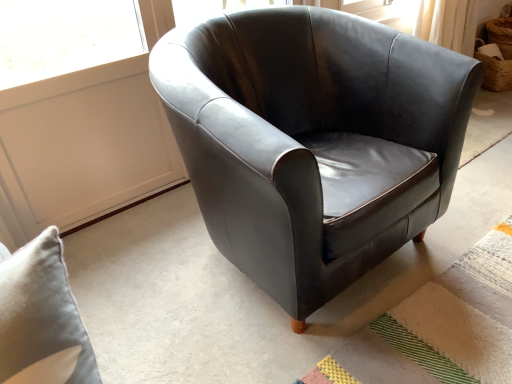
Question: Should I look upward or downward to see textured woven mat at lower right?

Choices:
 (A) up
 (B) down

Answer: (B)

Question: Could you tell me if textured woven mat at lower right is turned towards matte black armchair at center?

Choices:
 (A) yes
 (B) no

Answer: (B)

Question: Considering the relative sizes of textured woven mat at lower right and matte black armchair at center in the image provided, is textured woven mat at lower right thinner than matte black armchair at center?

Choices:
 (A) yes
 (B) no

Answer: (B)

Question: Considering the relative sizes of textured woven mat at lower right and matte black armchair at center in the image provided, is textured woven mat at lower right shorter than matte black armchair at center?

Choices:
 (A) yes
 (B) no

Answer: (A)

Question: Can you confirm if textured woven mat at lower right is bigger than matte black armchair at center?

Choices:
 (A) no
 (B) yes

Answer: (A)

Question: Considering the relative positions of textured woven mat at lower right and matte black armchair at center in the image provided, is textured woven mat at lower right behind matte black armchair at center?

Choices:
 (A) yes
 (B) no

Answer: (A)

Question: Does textured woven mat at lower right lie in front of matte black armchair at center?

Choices:
 (A) yes
 (B) no

Answer: (B)

Question: Considering the relative positions of matte black armchair at center and textured woven mat at lower right in the image provided, is matte black armchair at center to the left of textured woven mat at lower right from the viewer's perspective?

Choices:
 (A) no
 (B) yes

Answer: (B)

Question: From the image's perspective, is matte black armchair at center located beneath textured woven mat at lower right?

Choices:
 (A) yes
 (B) no

Answer: (B)

Question: Considering the relative positions of matte black armchair at center and textured woven mat at lower right in the image provided, is matte black armchair at center in front of textured woven mat at lower right?

Choices:
 (A) no
 (B) yes

Answer: (B)

Question: Is matte black armchair at center not close to textured woven mat at lower right?

Choices:
 (A) yes
 (B) no

Answer: (B)

Question: From a real-world perspective, is matte black armchair at center below textured woven mat at lower right?

Choices:
 (A) no
 (B) yes

Answer: (A)

Question: Does matte black armchair at center have a lesser width compared to textured woven mat at lower right?

Choices:
 (A) yes
 (B) no

Answer: (A)

Question: Is matte black armchair at center inside the boundaries of textured woven mat at lower right, or outside?

Choices:
 (A) inside
 (B) outside

Answer: (B)